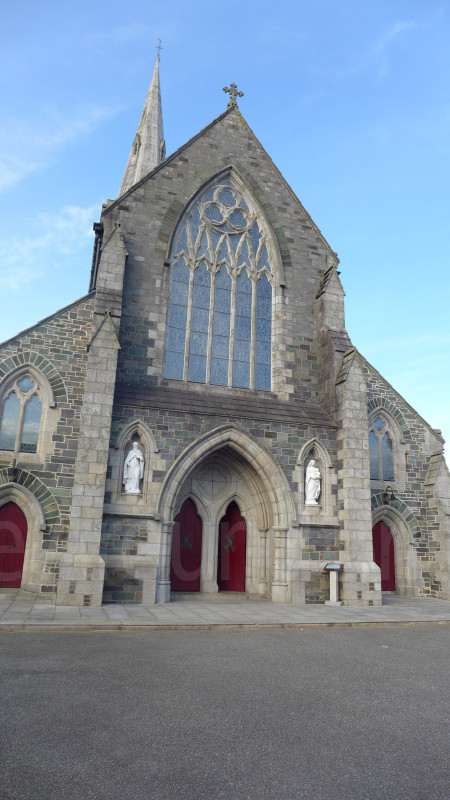
The height and width of the screenshot is (800, 450). I want to click on windows, so click(135, 145), click(163, 150), click(223, 338), click(18, 418), click(381, 458).